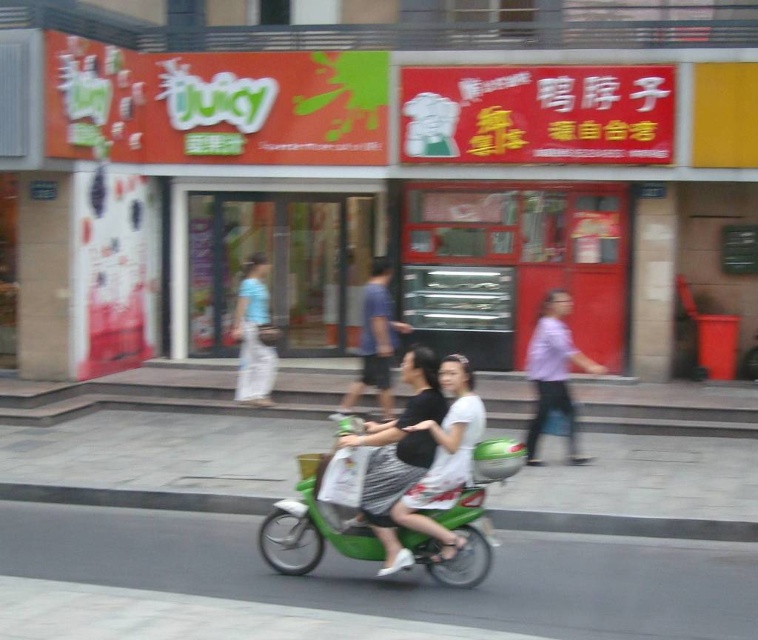
You are standing in the street scene and want to pick up the black textured dress at center. Can you reach it without moving closer?

The black textured dress at center is 6.96 meters from viewer, so you cannot reach it without moving closer.

You are a fashion designer observing the two outfits in the image. The outfits are the black textured dress at center and the blue cotton shirt at center. Which outfit has a narrower silhouette?

The black textured dress at center is thinner than the blue cotton shirt at center, so the black textured dress at center has a narrower silhouette.

Looking at this image, you are a fashion designer observing a street scene. You notice two outfits in the image. The first is a black textured dress at center and the second is light blue fabric pants at left. Which outfit takes up more space in the image?

The light blue fabric pants at left take up more space in the image because the black textured dress at center is smaller than light blue fabric pants at left.